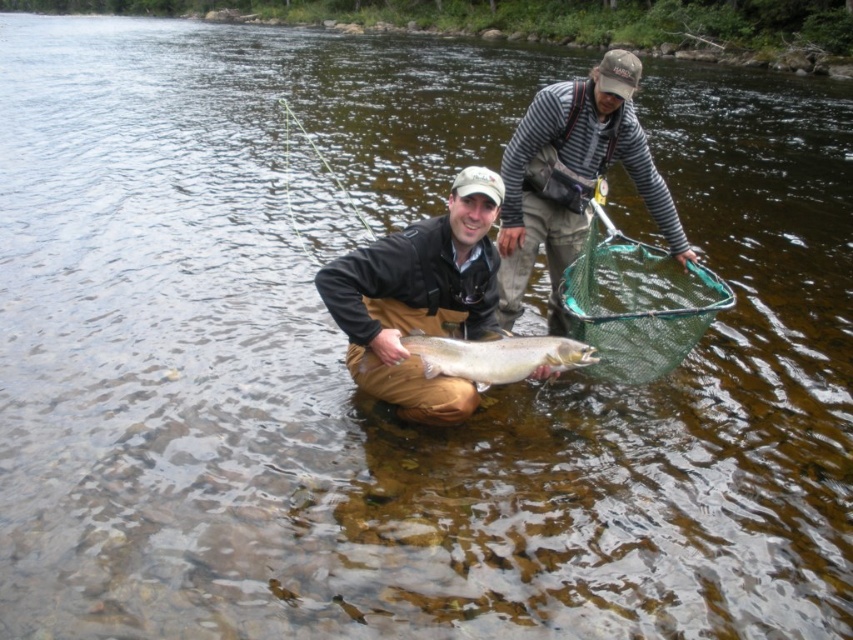
Question: Which point is farther to the camera?

Choices:
 (A) (x=433, y=368)
 (B) (x=468, y=403)

Answer: (B)

Question: Does matte brown waders at center appear on the right side of shiny silver fish at center?

Choices:
 (A) no
 (B) yes

Answer: (A)

Question: Considering the relative positions of matte brown waders at center and striped long-sleeve shirt at upper right in the image provided, where is matte brown waders at center located with respect to striped long-sleeve shirt at upper right?

Choices:
 (A) below
 (B) above

Answer: (A)

Question: Estimate the real-world distances between objects in this image. Which object is farther from the matte brown waders at center?

Choices:
 (A) shiny silver fish at center
 (B) striped long-sleeve shirt at upper right

Answer: (B)

Question: Among these objects, which one is farthest from the camera?

Choices:
 (A) striped long-sleeve shirt at upper right
 (B) matte brown waders at center

Answer: (A)

Question: Is matte brown waders at center bigger than shiny silver fish at center?

Choices:
 (A) no
 (B) yes

Answer: (B)